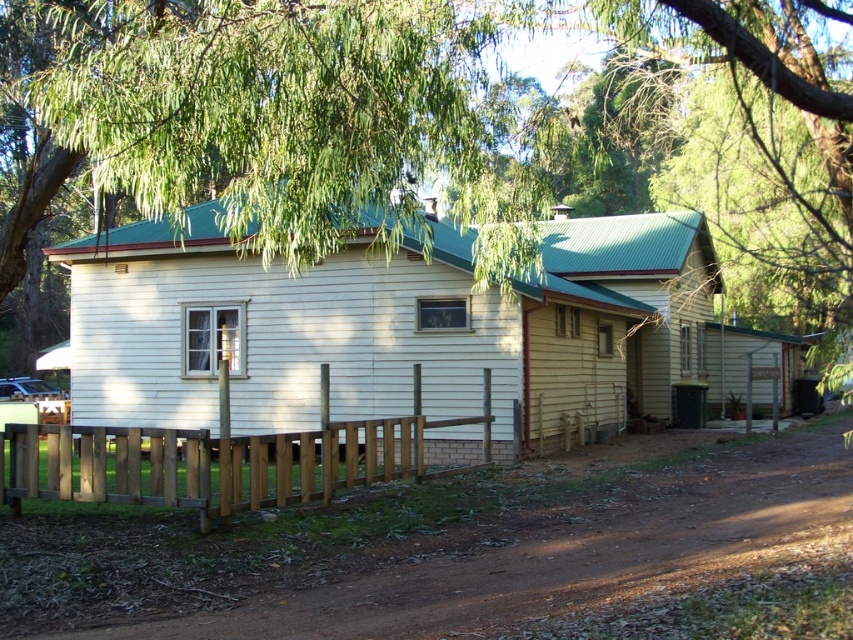
You are standing at the entrance of the house and want to walk to the brown dirt track at lower center. Which direction should you move relative to the brown wooden fence at lower center?

You should move to the right of the brown wooden fence at lower center to reach the brown dirt track at lower center since the brown dirt track at lower center is positioned to the right of the brown wooden fence at lower center.

You are standing at the point marked by the coordinates point (419, 547). Looking towards the house, which direction should you walk to reach the wooden fence that surrounds the front yard?

The brown dirt track at lower center is represented by point (419, 547). Since the dirt track leads up to the house and the fence is along the front yard, you should walk towards the house along the dirt track to reach the wooden fence.